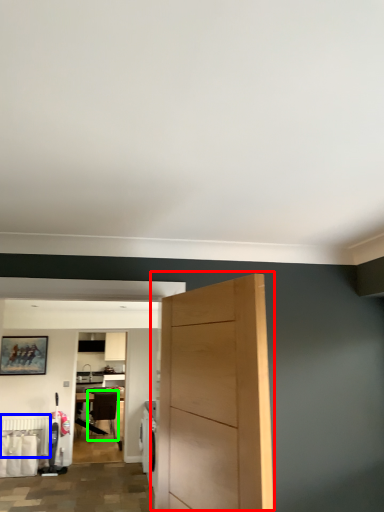
Question: Estimate the real-world distances between objects in this image. Which object is closer to door (highlighted by a red box), radiator (highlighted by a blue box) or chair (highlighted by a green box)?

Choices:
 (A) radiator
 (B) chair

Answer: (A)